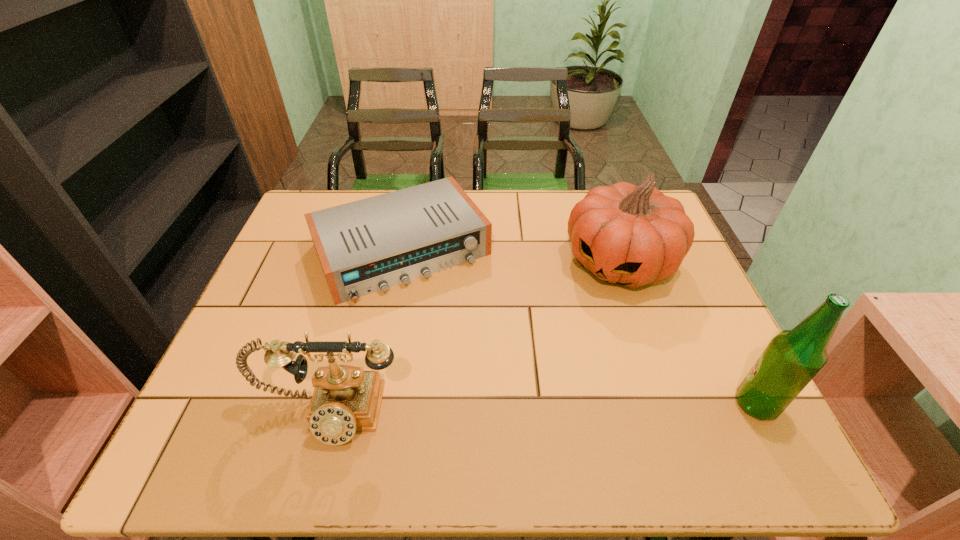
Identify the location of object that is the nearest to the second shortest object. (365, 246).

The width and height of the screenshot is (960, 540). In order to click on the closest object relative to the radio receiver in this screenshot , I will do `click(632, 235)`.

Locate an element on the screen. free region that satisfies the following two spatial constraints: 1. on the front side of the tallest object; 2. on the label of the pumpkin is located at coordinates (668, 404).

Image resolution: width=960 pixels, height=540 pixels. Identify the location of free space that satisfies the following two spatial constraints: 1. on the front side of the beer bottle; 2. on the label of the radio receiver. (371, 404).

In order to click on vacant space that satisfies the following two spatial constraints: 1. on the front side of the beer bottle; 2. on the label of the pumpkin in this screenshot , I will do `click(668, 404)`.